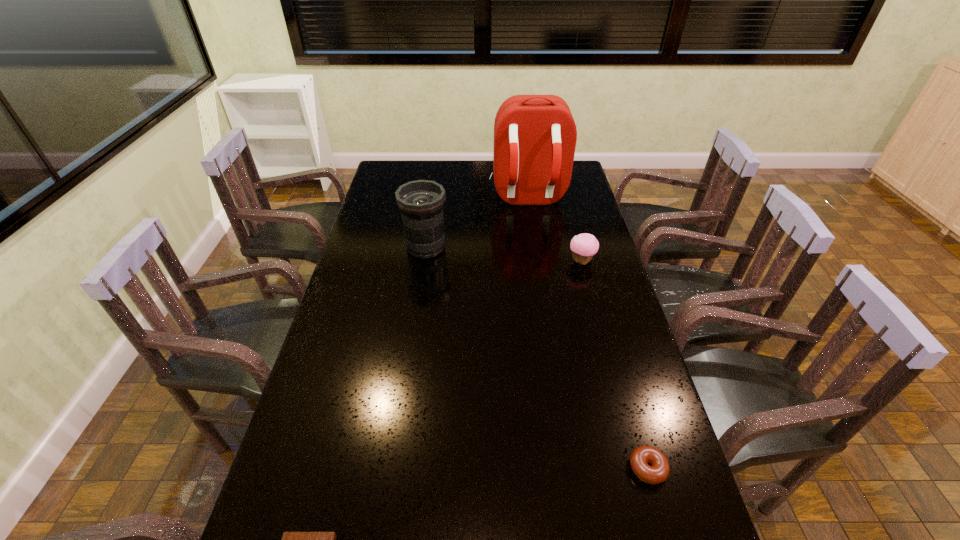
Where is `free location located on the left of the doughnut`? free location located on the left of the doughnut is located at coordinates (568, 468).

The image size is (960, 540). I want to click on object present at the far edge, so click(x=535, y=136).

Where is `backpack at the right edge`? Image resolution: width=960 pixels, height=540 pixels. backpack at the right edge is located at coordinates (535, 136).

Image resolution: width=960 pixels, height=540 pixels. Identify the location of cupcake positioned at the right edge. (583, 246).

You are a GUI agent. You are given a task and a screenshot of the screen. Output one action in this format:
    pyautogui.click(x=<x>, y=<y>)
    Task: Click on the doughnut that is at the right edge
    The height and width of the screenshot is (540, 960).
    Given the screenshot: What is the action you would take?
    pyautogui.click(x=659, y=471)

At what (x,y) coordinates should I click in order to perform the action: click on object located in the far right corner section of the desktop. Please return your answer as a coordinate pair (x, y). The width and height of the screenshot is (960, 540). Looking at the image, I should click on (535, 136).

In order to click on blank space at the far edge in this screenshot , I will do `click(477, 165)`.

You are a GUI agent. You are given a task and a screenshot of the screen. Output one action in this format:
    pyautogui.click(x=<x>, y=<y>)
    Task: Click on the blank space at the left edge of the desktop
    The height and width of the screenshot is (540, 960).
    Given the screenshot: What is the action you would take?
    pyautogui.click(x=370, y=276)

Identify the location of vacant space at the right edge of the desktop. The height and width of the screenshot is (540, 960). click(581, 327).

I want to click on free space at the far left corner of the desktop, so click(410, 161).